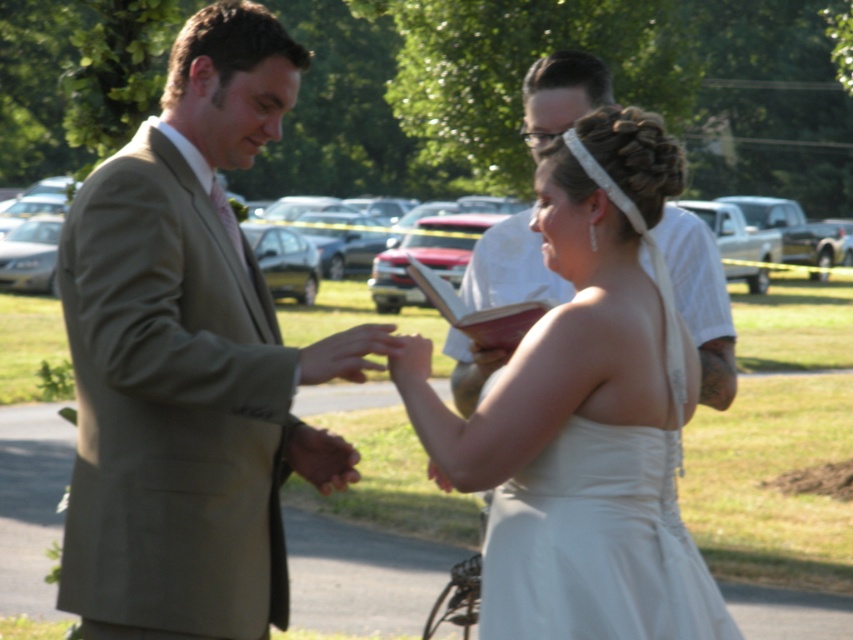
Who is higher up, light brown suit at center or white textured book at upper center?

white textured book at upper center is above.

Is light brown suit at center to the right of white textured book at upper center from the viewer's perspective?

No, light brown suit at center is not to the right of white textured book at upper center.

The width and height of the screenshot is (853, 640). Find the location of `light brown suit at center`. light brown suit at center is located at coordinates (189, 358).

Does light brown suit at center appear over white satin dress at center?

Indeed, light brown suit at center is positioned over white satin dress at center.

Is light brown suit at center taller than white satin dress at center?

Correct, light brown suit at center is much taller as white satin dress at center.

Does point (233, 566) lie behind point (599, 256)?

Yes.

In order to click on light brown suit at center in this screenshot , I will do `click(189, 358)`.

Is white satin dress at center above white textured book at upper center?

No, white satin dress at center is not above white textured book at upper center.

Identify the location of white satin dress at center. (570, 422).

Between point (514, 369) and point (521, 253), which one is positioned in front?

Point (514, 369) is more forward.

This screenshot has width=853, height=640. Identify the location of white satin dress at center. (570, 422).